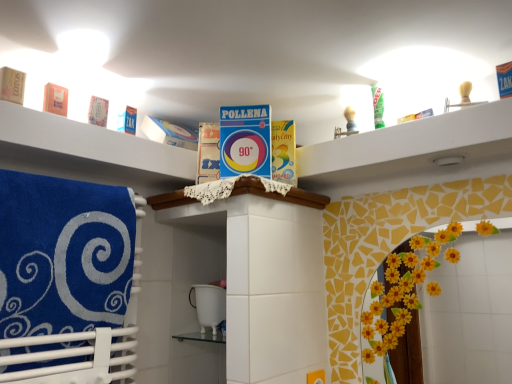
Question: In the image, is white cardboard box at upper center on the left side or the right side of blue soft towel at left?

Choices:
 (A) right
 (B) left

Answer: (A)

Question: Is point (31, 112) closer or farther from the camera than point (77, 258)?

Choices:
 (A) closer
 (B) farther

Answer: (A)

Question: Do you think white cardboard box at upper center is within blue soft towel at left, or outside of it?

Choices:
 (A) outside
 (B) inside

Answer: (A)

Question: Would you say blue soft towel at left is to the left or to the right of white cardboard box at upper center in the picture?

Choices:
 (A) right
 (B) left

Answer: (B)

Question: Considering the positions of blue soft towel at left and white cardboard box at upper center in the image, is blue soft towel at left wider or thinner than white cardboard box at upper center?

Choices:
 (A) thin
 (B) wide

Answer: (A)

Question: Is blue soft towel at left inside the boundaries of white cardboard box at upper center, or outside?

Choices:
 (A) outside
 (B) inside

Answer: (A)

Question: From a real-world perspective, is blue soft towel at left physically located above or below white cardboard box at upper center?

Choices:
 (A) above
 (B) below

Answer: (B)